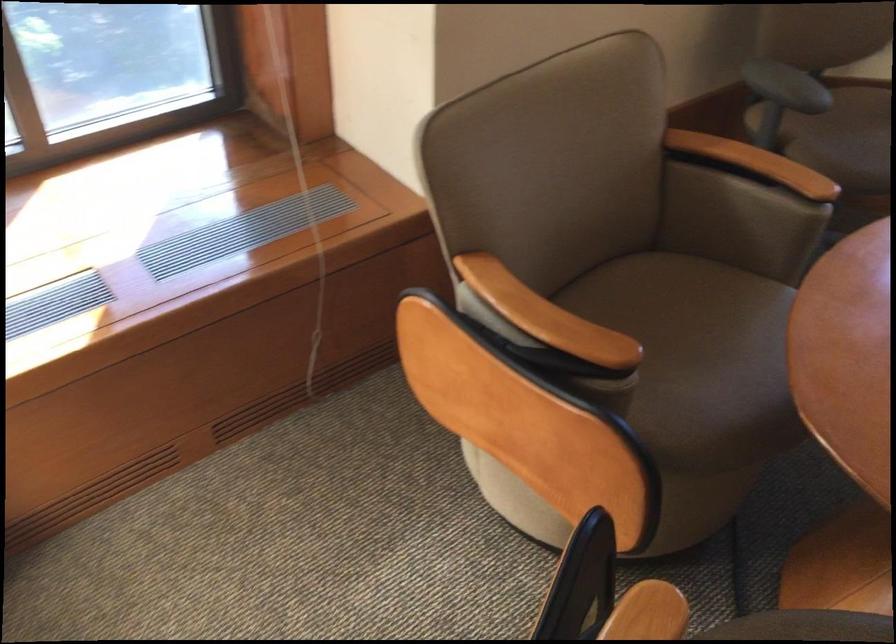
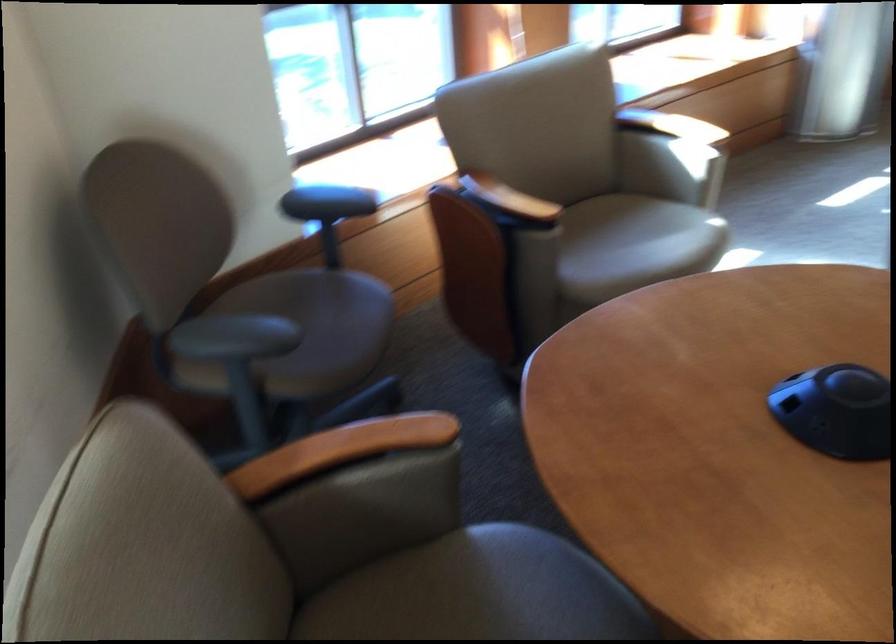
The point at [754,156] is marked in the first image. Where is the corresponding point in the second image?

(340, 450)